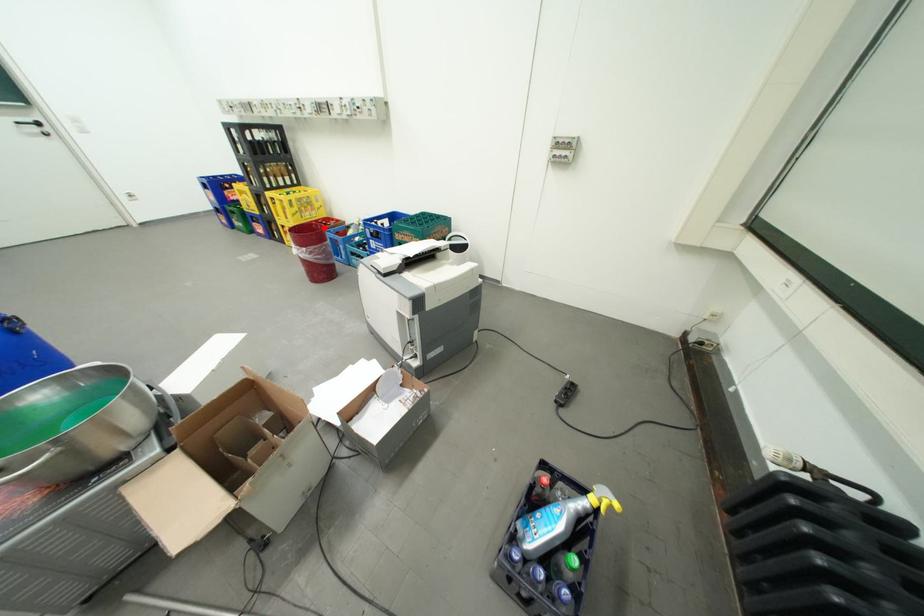
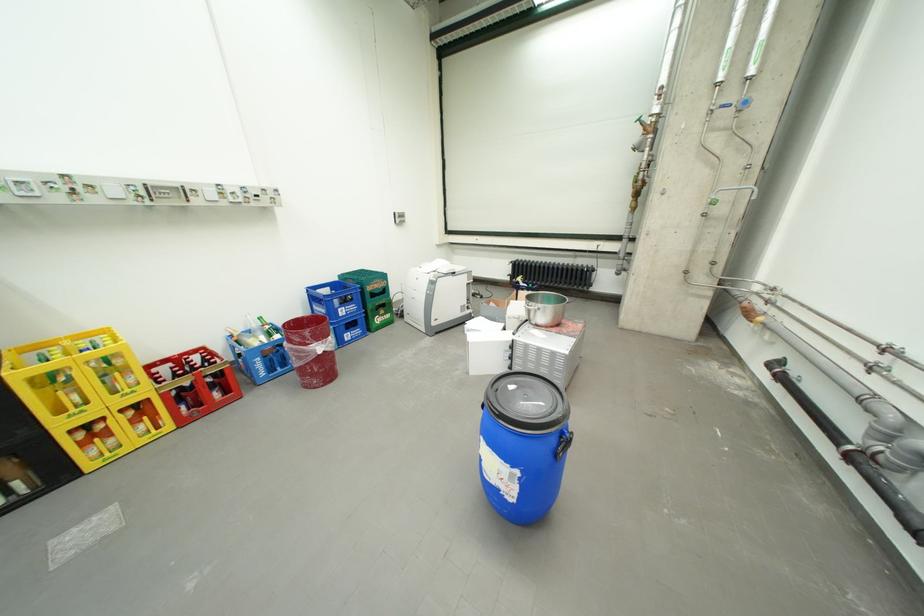
In the second image, find the point that corresponds to the highlighted location in the first image.

(297, 328)